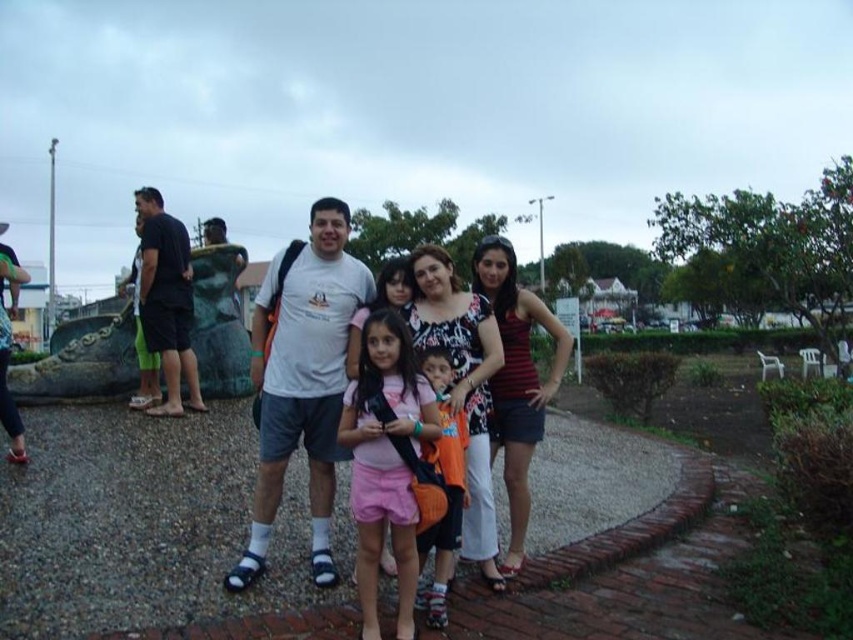
Does white cotton shirt at center have a lesser width compared to orange fabric shirt at center?

Yes.

Which is in front, point (279, 264) or point (433, 611)?

Positioned in front is point (433, 611).

This screenshot has width=853, height=640. Find the location of `white cotton shirt at center`. white cotton shirt at center is located at coordinates (302, 378).

In the scene shown: Is white cotton t-shirt at center positioned before orange fabric shirt at center?

No, it is not.

What do you see at coordinates (302, 380) in the screenshot? The width and height of the screenshot is (853, 640). I see `white cotton t-shirt at center` at bounding box center [302, 380].

Which is in front, point (270, 285) or point (424, 596)?

Point (424, 596) is in front.

Where is `white cotton t-shirt at center`? Image resolution: width=853 pixels, height=640 pixels. white cotton t-shirt at center is located at coordinates (302, 380).

Is point (296, 307) in front of point (297, 305)?

No, it is not.

Does white cotton shirt at center have a greater height compared to white cotton t-shirt at center?

Yes, white cotton shirt at center is taller than white cotton t-shirt at center.

Describe the element at coordinates (302, 378) in the screenshot. I see `white cotton shirt at center` at that location.

Image resolution: width=853 pixels, height=640 pixels. Identify the location of white cotton shirt at center. (302, 378).